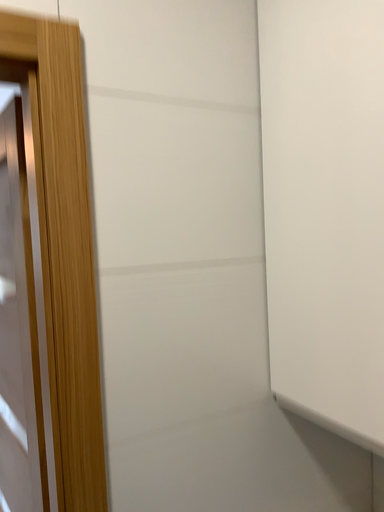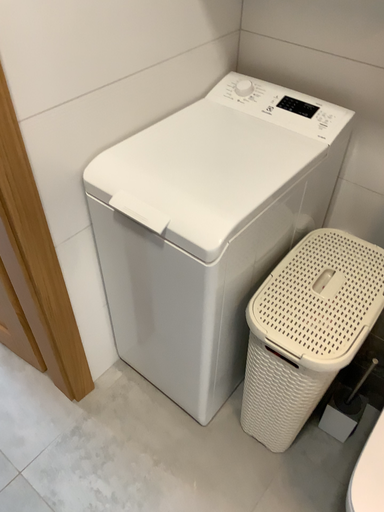
Question: How did the camera likely rotate when shooting the video?

Choices:
 (A) rotated upward
 (B) rotated downward

Answer: (B)